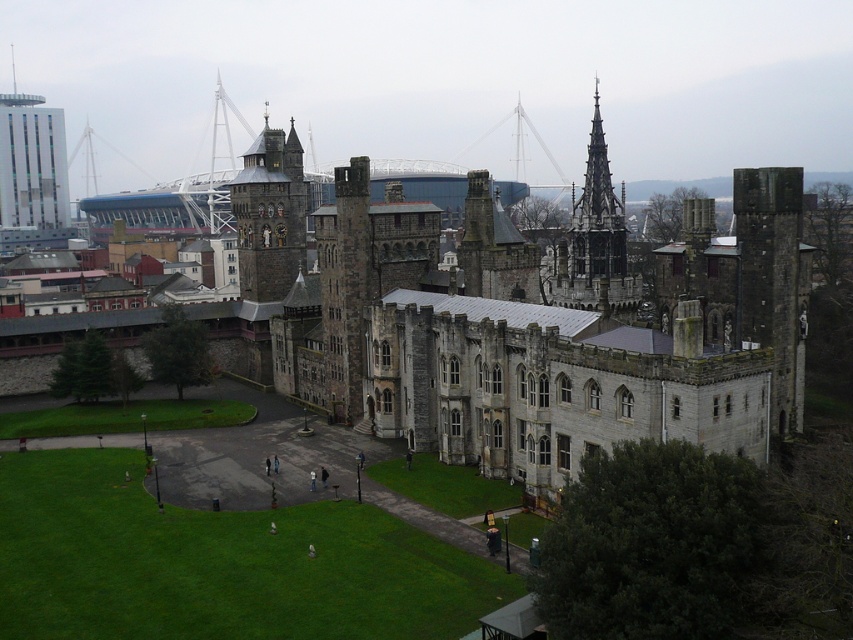
Question: Among these points, which one is farthest from the camera?

Choices:
 (A) (26, 99)
 (B) (584, 180)
 (C) (289, 211)

Answer: (A)

Question: Does dark gray stone tower at center appear over dark gray stone spire at upper right?

Choices:
 (A) yes
 (B) no

Answer: (B)

Question: Is matte glass skyscraper at upper left bigger than dark gray stone spire at upper right?

Choices:
 (A) yes
 (B) no

Answer: (B)

Question: Is matte glass skyscraper at upper left positioned at the back of dark gray stone spire at upper right?

Choices:
 (A) yes
 (B) no

Answer: (A)

Question: Which point is farther from the camera taking this photo?

Choices:
 (A) (288, 186)
 (B) (335, 276)
 (C) (606, 294)

Answer: (A)

Question: Among these objects, which one is nearest to the camera?

Choices:
 (A) gray stone castle at center
 (B) dark gray stone tower at center
 (C) matte glass skyscraper at upper left

Answer: (A)